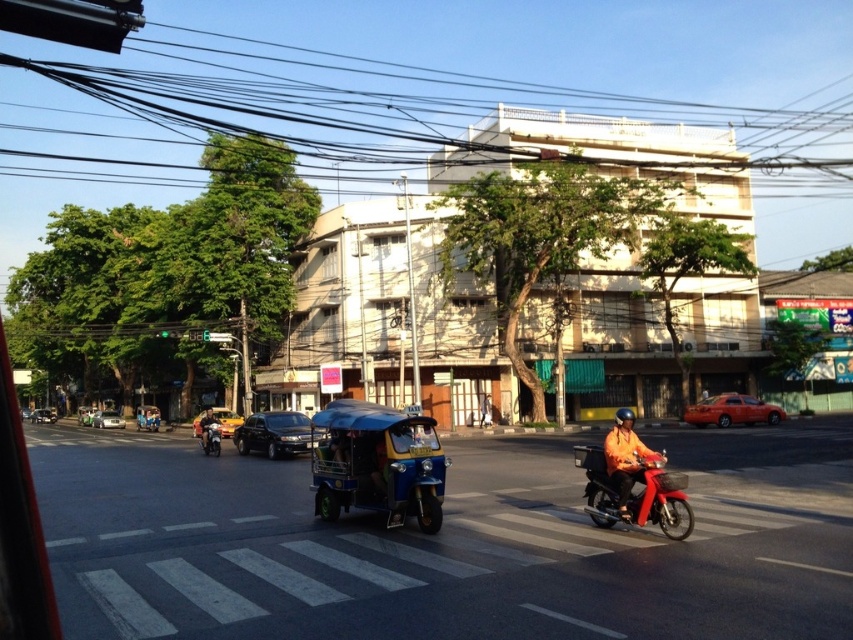
You are a pedestrian standing at the pedestrian crossing and want to get to the matte black sedan at center. There is an orange matte taxi at center right blocking the way. If you walk straight towards the sedan, will you have to go around the taxi?

The orange matte taxi at center right is 73.07 meters away from the matte black sedan at center. Since the distance between them is quite large, you can walk straight towards the matte black sedan at center without needing to go around the orange matte taxi at center right.

You are a delivery person needing to park your vehicle in a narrow alley that can only accommodate vehicles up to the width of the yellow metallic taxi at center. You have a yellow matte car at center. Can you safely park your vehicle there?

The yellow matte car at center is wider than the yellow metallic taxi at center, so it cannot safely park in the narrow alley designed for the taxi width.

You are a delivery person needing to cross the street to deliver a package. There is an orange matte helmet at center and a matte black sedan at center. Which object is closer to you as you stand at the pedestrian crossing?

The orange matte helmet at center is 69.94 meters away from the matte black sedan at center. Since you are standing at the pedestrian crossing, the distance between you and each object depends on their positions relative to you. However, the question asks which object is closer to you, but the description only provides the distance between the two objects. Without additional information about your exact position relative to both objects, it is impossible to determine which is closer. Therefore, the given 69